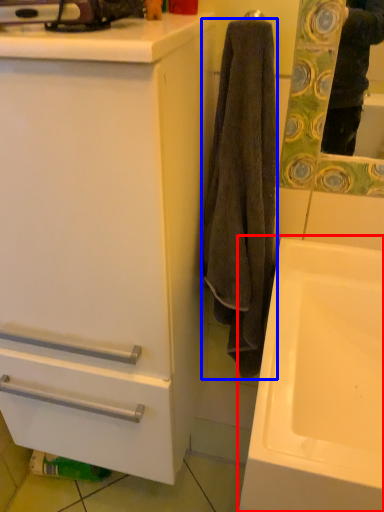
Question: Which point is closer to the camera, sink (highlighted by a red box) or towel/napkin (highlighted by a blue box)?

Choices:
 (A) sink
 (B) towel/napkin

Answer: (A)